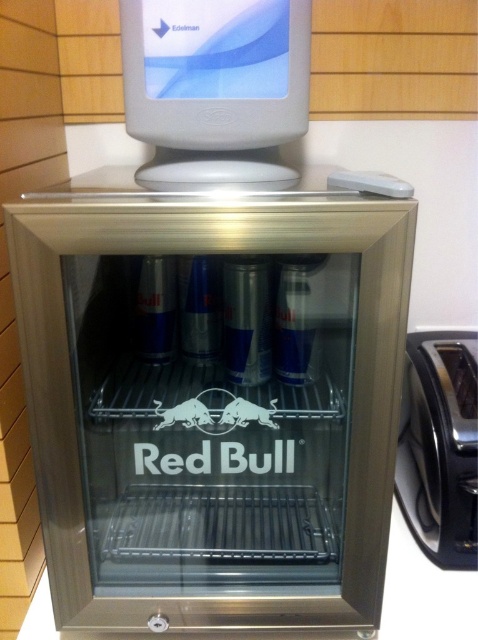
Question: Does satin silver fridge at center appear on the right side of white plastic monitor at upper center?

Choices:
 (A) yes
 (B) no

Answer: (B)

Question: Considering the real-world distances, which object is closest to the white plastic monitor at upper center?

Choices:
 (A) satin silver fridge at center
 (B) satin chrome toaster at lower right

Answer: (A)

Question: Which point is closer to the camera?

Choices:
 (A) (375, 369)
 (B) (141, 109)

Answer: (A)

Question: Which point is closer to the camera?

Choices:
 (A) (144, 204)
 (B) (422, 422)

Answer: (A)

Question: In this image, where is white plastic monitor at upper center located relative to satin chrome toaster at lower right?

Choices:
 (A) left
 (B) right

Answer: (A)

Question: Is satin silver fridge at center positioned in front of satin chrome toaster at lower right?

Choices:
 (A) no
 (B) yes

Answer: (B)